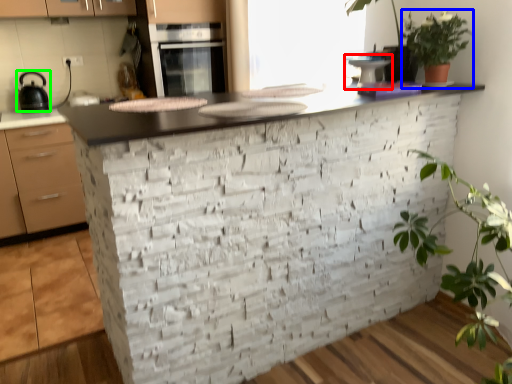
Question: Estimate the real-world distances between objects in this image. Which object is closer to appliance (highlighted by a red box), vegetation (highlighted by a blue box) or kitchen appliance (highlighted by a green box)?

Choices:
 (A) vegetation
 (B) kitchen appliance

Answer: (A)